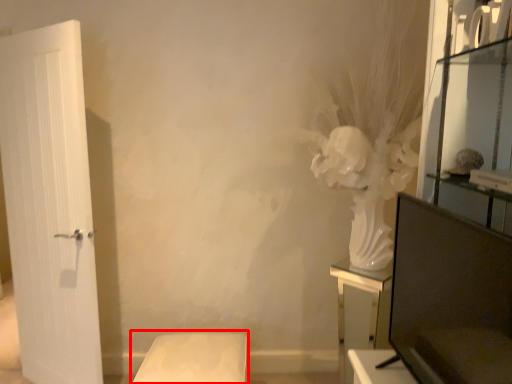
Question: Observing the image, what is the correct spatial positioning of furniture (annotated by the red box) in reference to furniture?

Choices:
 (A) left
 (B) right

Answer: (A)